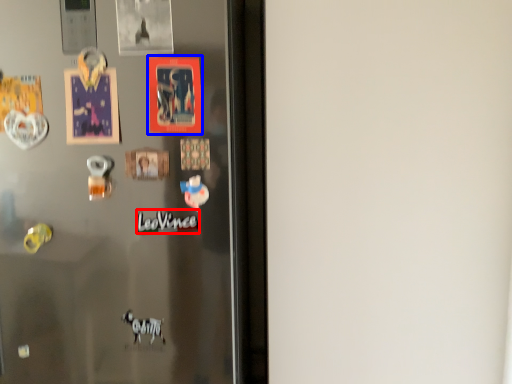
Question: Which point is further to the camera, writing (highlighted by a red box) or postcard (highlighted by a blue box)?

Choices:
 (A) writing
 (B) postcard

Answer: (A)